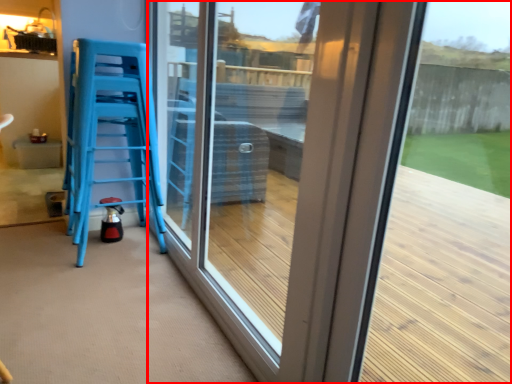
Question: Considering the relative positions of window (annotated by the red box) and furniture in the image provided, where is window (annotated by the red box) located with respect to the staircase?

Choices:
 (A) right
 (B) left

Answer: (A)